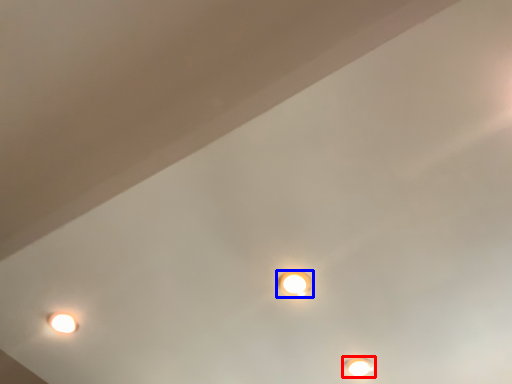
Question: Which object appears closest to the camera in this image, lamp (highlighted by a red box) or lamp (highlighted by a blue box)?

Choices:
 (A) lamp
 (B) lamp

Answer: (B)